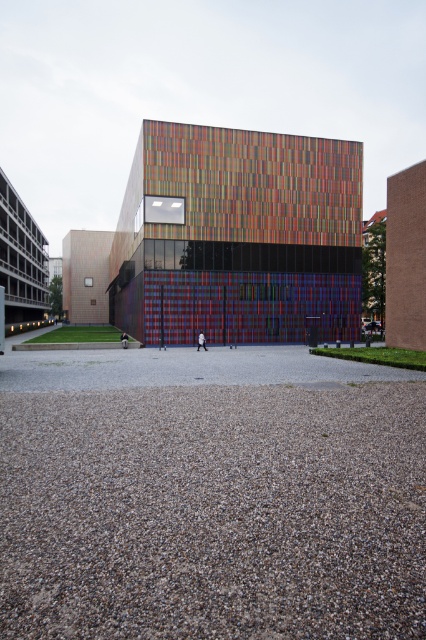
Question: In this image, where is gray gravel at lower center located relative to multicolored glass building at center?

Choices:
 (A) above
 (B) below

Answer: (B)

Question: Considering the relative positions of gray gravel at lower center and multicolored glass building at center in the image provided, where is gray gravel at lower center located with respect to multicolored glass building at center?

Choices:
 (A) below
 (B) above

Answer: (A)

Question: Does gray gravel at lower center have a lesser width compared to multicolored glass building at center?

Choices:
 (A) no
 (B) yes

Answer: (B)

Question: Which of the following is the farthest from the observer?

Choices:
 (A) multicolored glass building at center
 (B) gray gravel at lower center

Answer: (A)

Question: Which of the following is the closest to the observer?

Choices:
 (A) (131, 298)
 (B) (353, 504)

Answer: (B)